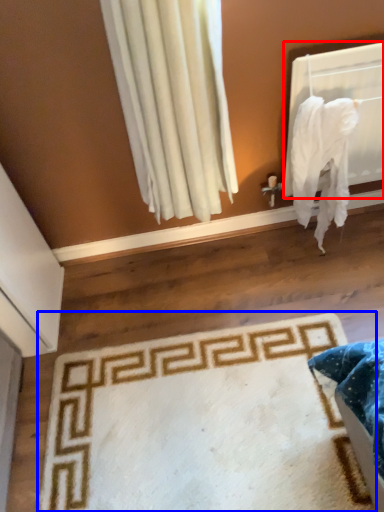
Question: Which object is closer to the camera taking this photo, window screen (highlighted by a red box) or mat (highlighted by a blue box)?

Choices:
 (A) window screen
 (B) mat

Answer: (B)